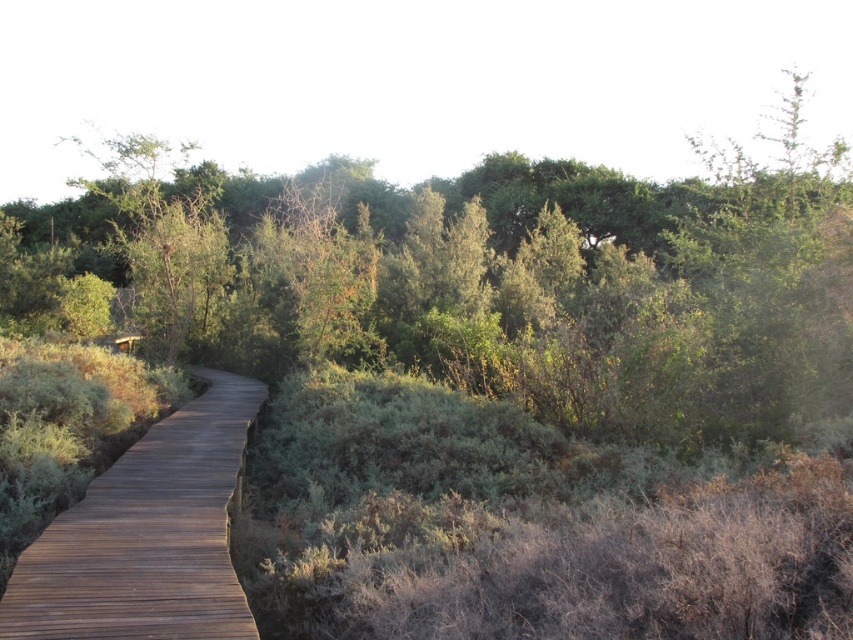
You are standing at the start of the wooden boardwalk at center and want to find the green leafy tree at upper left. Which direction should you look to see it?

The green leafy tree at upper left is to the left of the wooden boardwalk at center, so you should look to your left to see it.

You are standing at the start of the wooden boardwalk at center and want to reach the green leafy tree at upper left. Which direction should you walk to get closer to the tree?

The wooden boardwalk at center is closer to the viewer than the green leafy tree at upper left. To reach the tree, you should walk forward along the boardwalk as it curves gently to the left, which aligns with the direction of the tree.